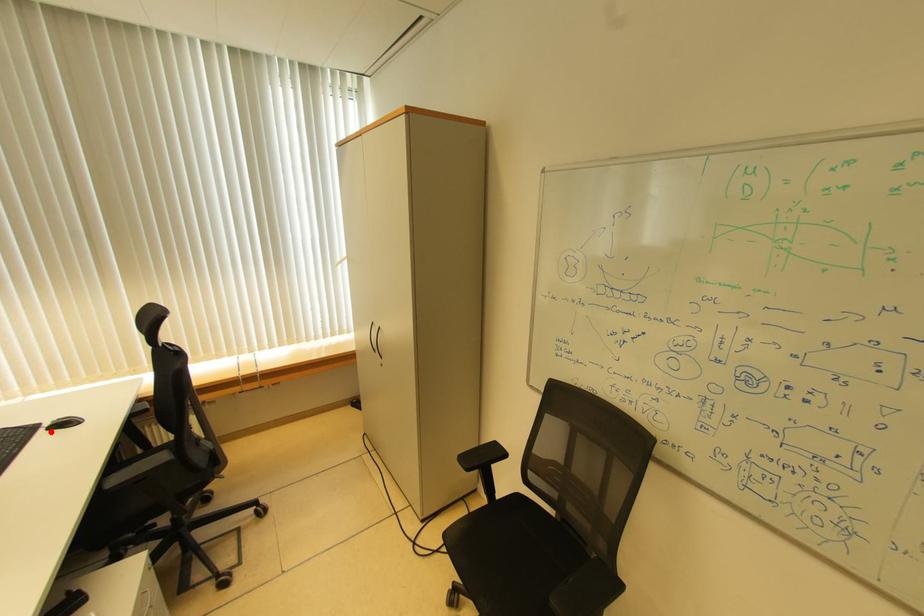
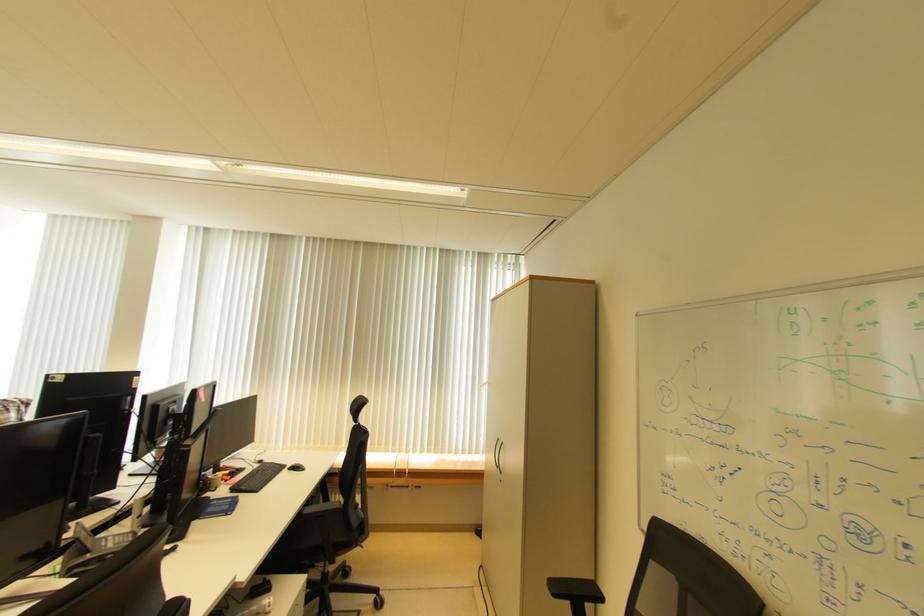
Where in the second image is the point corresponding to the highlighted location from the first image?

(295, 471)